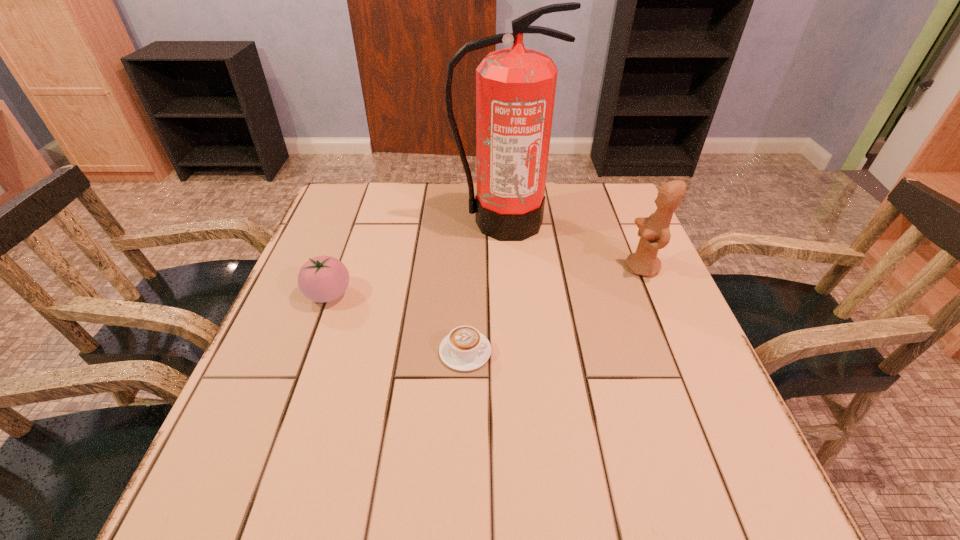
Identify the location of fire extinguisher. (515, 87).

Where is `the tallest object`? This screenshot has width=960, height=540. the tallest object is located at coordinates (515, 87).

Identify the location of figurine. This screenshot has height=540, width=960. (654, 232).

The width and height of the screenshot is (960, 540). I want to click on the rightmost object, so click(654, 232).

Where is `tomato`? tomato is located at coordinates (321, 279).

You are a GUI agent. You are given a task and a screenshot of the screen. Output one action in this format:
    pyautogui.click(x=<x>, y=<y>)
    Task: Click on the leftmost object
    Image resolution: width=960 pixels, height=540 pixels.
    Given the screenshot: What is the action you would take?
    pyautogui.click(x=321, y=279)

Where is `the shortest object`? This screenshot has height=540, width=960. the shortest object is located at coordinates (464, 349).

Locate an element on the screen. This screenshot has width=960, height=540. cappuccino is located at coordinates (464, 349).

Where is `vacant space situated 0.080m on the front side of the tallest object`? This screenshot has width=960, height=540. vacant space situated 0.080m on the front side of the tallest object is located at coordinates (505, 261).

Locate an element on the screen. Image resolution: width=960 pixels, height=540 pixels. free space located 0.300m on the front-facing side of the second tallest object is located at coordinates (503, 267).